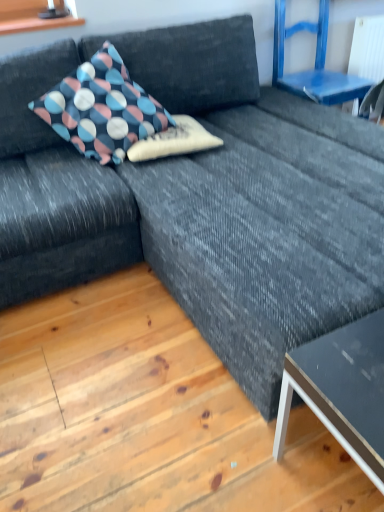
Question: Is polka dot fabric pillow at upper left, the 1th pillow in the left-to-right sequence, wider or thinner than matte black table at lower right?

Choices:
 (A) wide
 (B) thin

Answer: (A)

Question: Looking at the image, does polka dot fabric pillow at upper left, the 2th pillow viewed from the right, seem bigger or smaller compared to matte black table at lower right?

Choices:
 (A) small
 (B) big

Answer: (B)

Question: Which object is positioned closest to the polka dot fabric pillow at upper left, the 1th pillow in the left-to-right sequence?

Choices:
 (A) matte black table at lower right
 (B) polka dot fabric pillow at center, positioned as the 2th pillow in left-to-right order
 (C) blue painted wood chair at upper right

Answer: (B)

Question: Based on their relative distances, which object is nearer to the matte black table at lower right?

Choices:
 (A) polka dot fabric pillow at upper left, the 2th pillow viewed from the right
 (B) polka dot fabric pillow at center, positioned as the 2th pillow in left-to-right order
 (C) blue painted wood chair at upper right

Answer: (B)